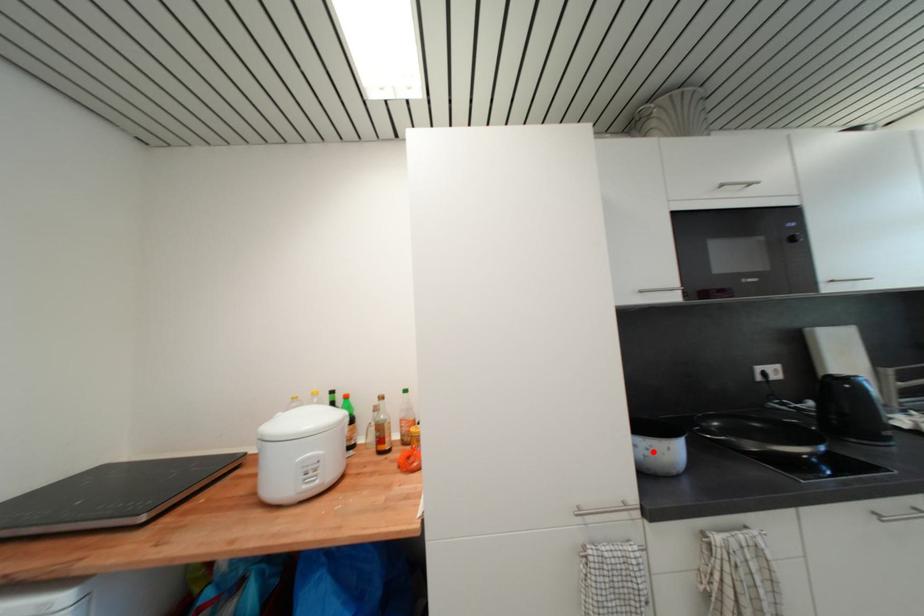
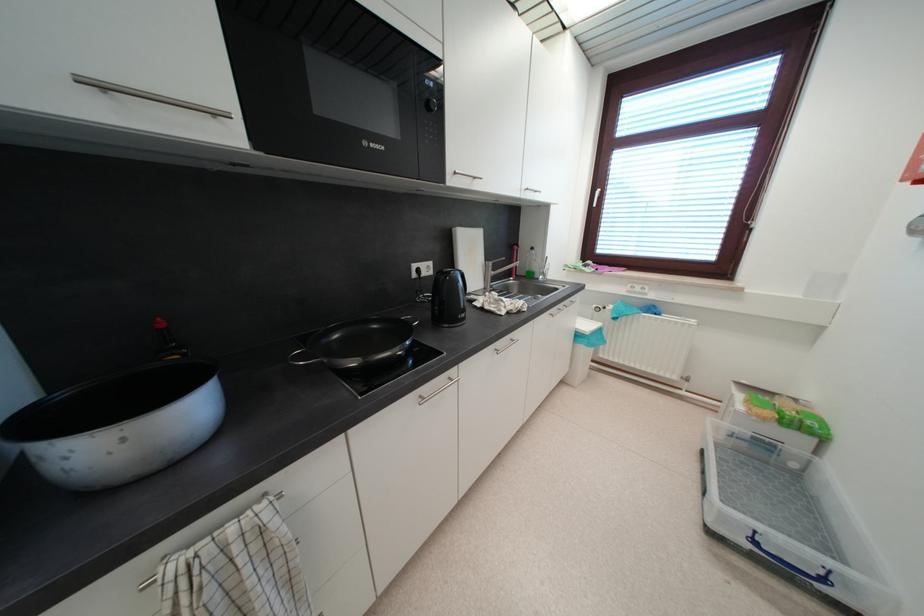
The point at the highlighted location is marked in the first image. Where is the corresponding point in the second image?

(71, 461)